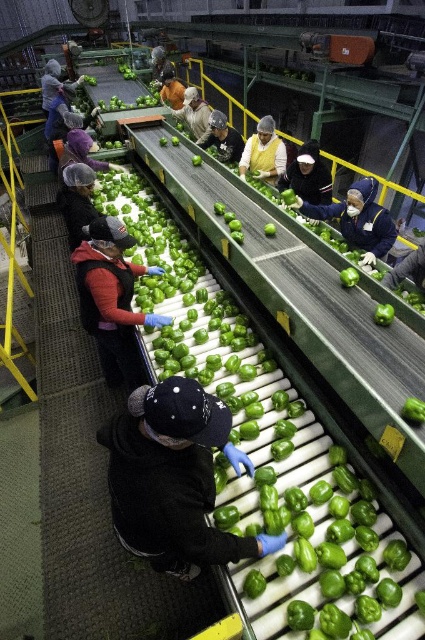
Question: Which point is closer to the camera?

Choices:
 (A) (76, 176)
 (B) (65, 144)
 (C) (108, 385)

Answer: (A)

Question: Is blue fabric gloves at center positioned behind brown hair at center?

Choices:
 (A) no
 (B) yes

Answer: (A)

Question: Is black fabric hat at center thinner than matte black jacket at center?

Choices:
 (A) no
 (B) yes

Answer: (B)

Question: Estimate the real-world distances between objects in this image. Which object is farther from the black fabric hat at center?

Choices:
 (A) matte black jacket at center
 (B) matte black jacket at upper left
 (C) yellow fabric at center
 (D) matte black jacket at left

Answer: (B)

Question: Is blue fabric gloves at center behind yellow fabric at center?

Choices:
 (A) yes
 (B) no

Answer: (B)

Question: Among these points, which one is nearest to the camera?

Choices:
 (A) (198, 552)
 (B) (221, 160)
 (C) (331, 184)
 (D) (198, 124)

Answer: (A)